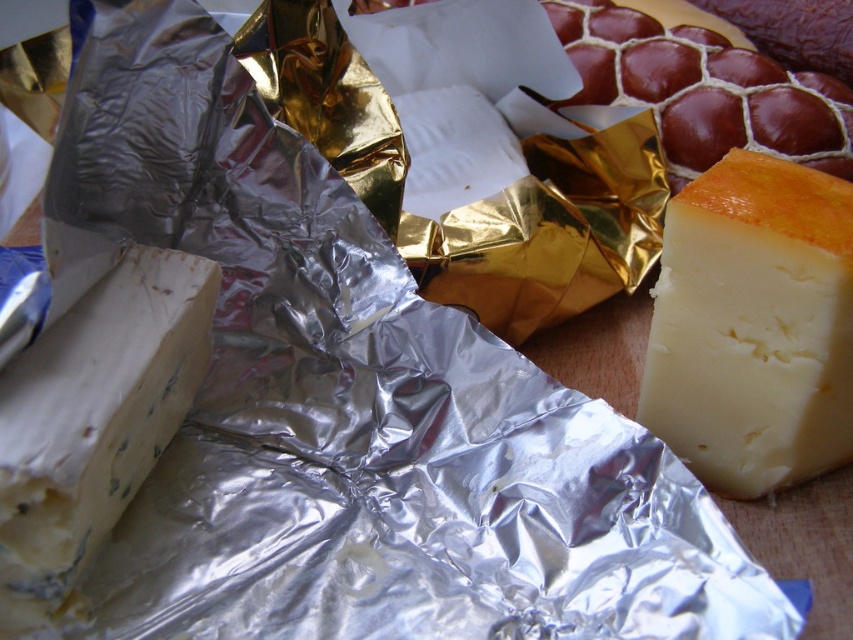
You are a cheese connoisseur examining the arrangement of cheeses on the wooden surface. Which cheese, the yellow creamy cheese at right or the blue veined cheese at lower left, is closer to you?

The yellow creamy cheese at right is closer to you because it is further to the viewer than the blue veined cheese at lower left, meaning it appears nearer in the scene.

You are arranging cheese on a wooden board for a party. You have a yellow creamy cheese at right and a blue veined cheese at lower left. Which cheese is positioned more to the right side of the board?

The yellow creamy cheese at right is positioned more to the right side of the board compared to the blue veined cheese at lower left.